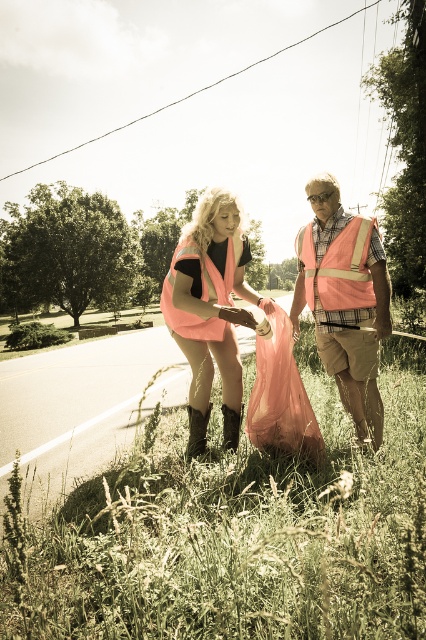
Which is in front, point (348, 620) or point (227, 243)?

Point (348, 620)

Who is more forward, (x=48, y=548) or (x=216, y=304)?

Point (x=48, y=548) is in front.

At what (x,y) coordinates should I click in order to perform the action: click on green grass at lower center. Please return your answer as a coordinate pair (x, y). Looking at the image, I should click on (233, 536).

Can you confirm if green grass at lower center is shorter than orange reflective safety vest at right?

Incorrect, green grass at lower center's height does not fall short of orange reflective safety vest at right's.

Which is behind, point (48, 540) or point (348, 253)?

Point (348, 253)

The image size is (426, 640). What do you see at coordinates (233, 536) in the screenshot?
I see `green grass at lower center` at bounding box center [233, 536].

Where is `green grass at lower center`? This screenshot has width=426, height=640. green grass at lower center is located at coordinates (233, 536).

Is reflective orange vest at center to the left of orange reflective safety vest at right from the viewer's perspective?

Indeed, reflective orange vest at center is positioned on the left side of orange reflective safety vest at right.

Where is `reflective orange vest at center`? The image size is (426, 640). reflective orange vest at center is located at coordinates (345, 301).

Identify the location of reflective orange vest at center. The image size is (426, 640). (345, 301).